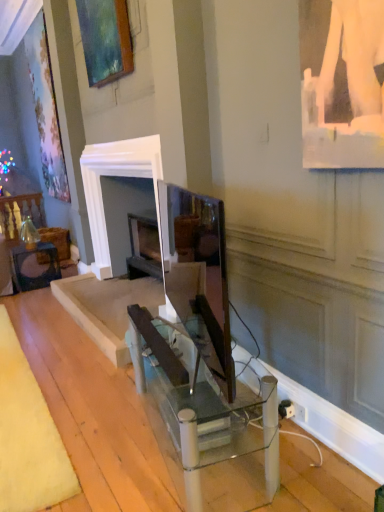
You are a GUI agent. You are given a task and a screenshot of the screen. Output one action in this format:
    pyautogui.click(x=<x>, y=<y>)
    Task: Click on the free space to the left of clear glass table at center, the second table viewed from the top
    This screenshot has height=512, width=384.
    Given the screenshot: What is the action you would take?
    pyautogui.click(x=91, y=440)